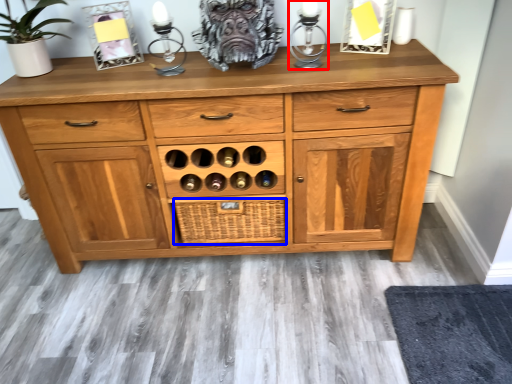
Question: Among these objects, which one is farthest to the camera, candle holder (highlighted by a red box) or crate (highlighted by a blue box)?

Choices:
 (A) candle holder
 (B) crate

Answer: (B)